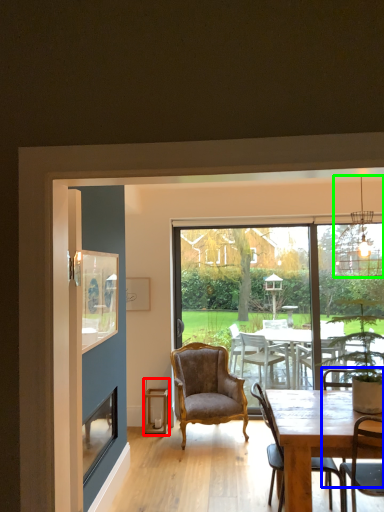
Question: Estimate the real-world distances between objects in this image. Which object is farther from lantern (highlighted by a red box), armchair (highlighted by a blue box) or lamp (highlighted by a green box)?

Choices:
 (A) armchair
 (B) lamp

Answer: (B)